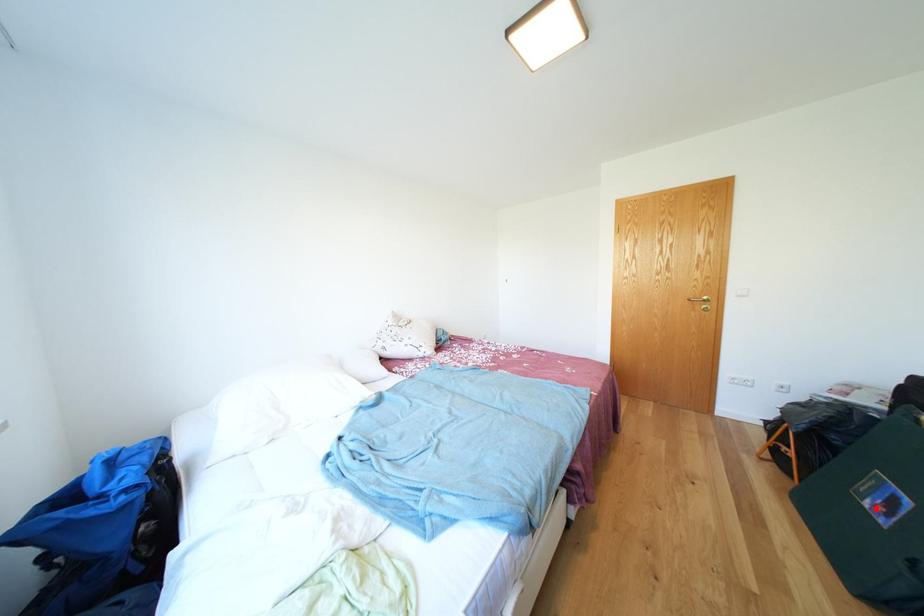
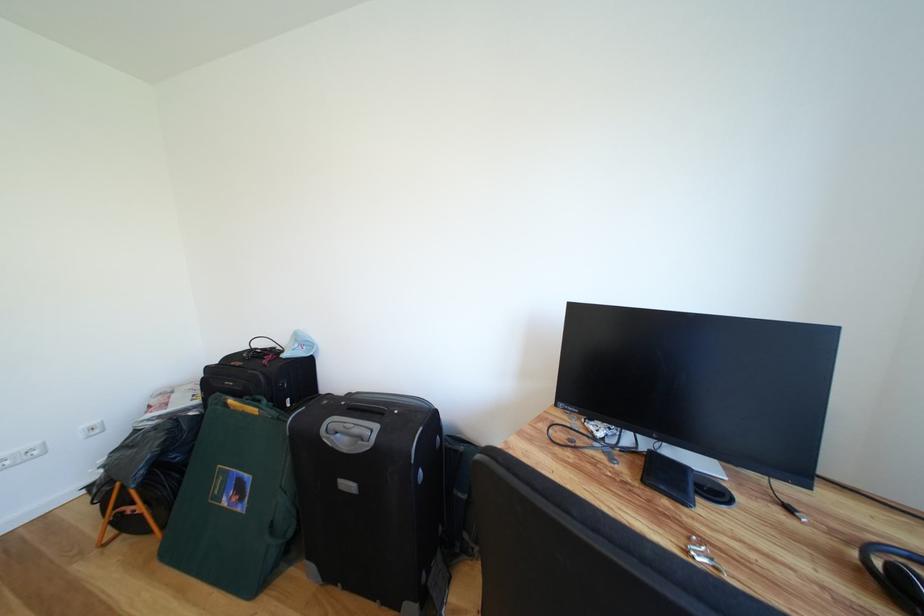
Locate, in the second image, the point that corresponds to the highlighted location in the first image.

(234, 506)